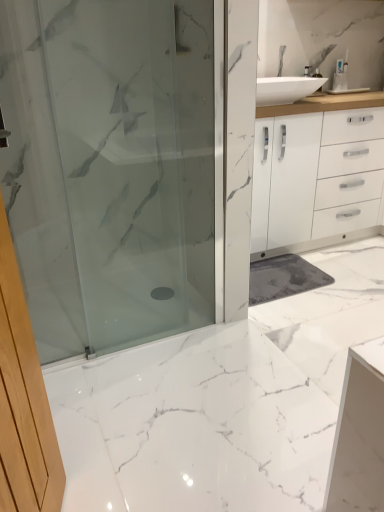
At what (x,y) coordinates should I click in order to perform the action: click on vacant area that is situated to the right of satin glass shower door at center. Please return your answer as a coordinate pair (x, y). The width and height of the screenshot is (384, 512). Looking at the image, I should click on coord(225,348).